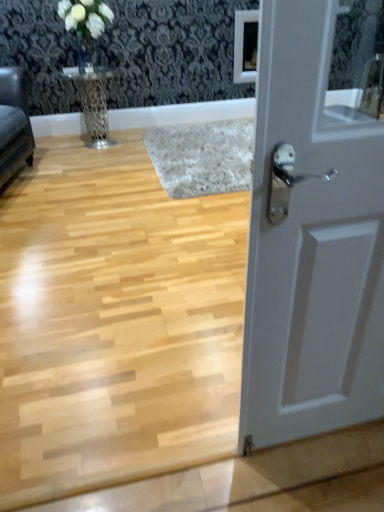
The width and height of the screenshot is (384, 512). What are the coordinates of `free space on the front side of metallic silver table at upper left` in the screenshot? It's located at (90, 163).